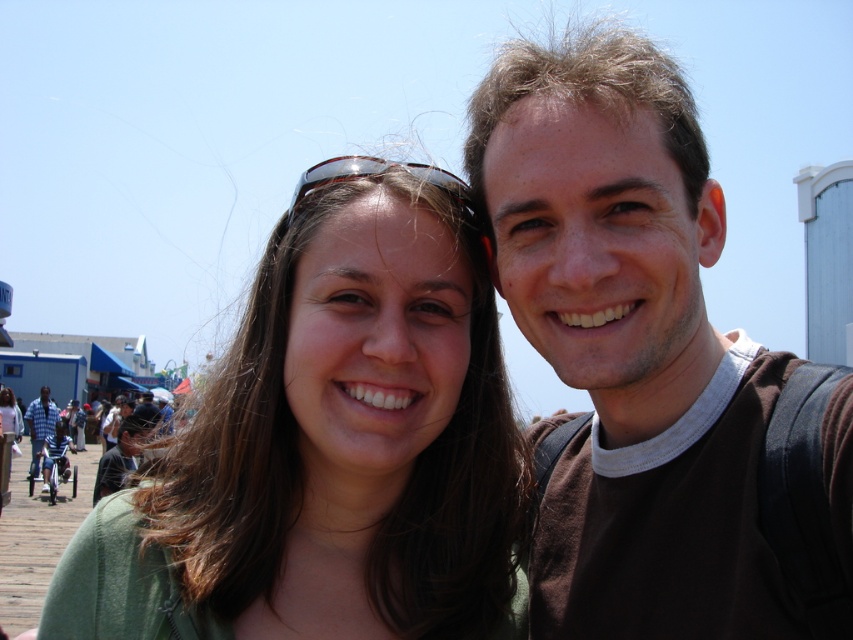
Based on the photo, who is taller, green matte hair at center or blue striped shirt at left?

With more height is green matte hair at center.

Which is below, green matte hair at center or blue striped shirt at left?

blue striped shirt at left

In order to click on green matte hair at center in this screenshot , I will do `click(329, 445)`.

Between sunglasses at center and blue striped shirt at left, which one is positioned lower?

blue striped shirt at left

Is point (434, 172) positioned before point (32, 422)?

Yes, point (434, 172) is in front of point (32, 422).

Between point (428, 166) and point (28, 410), which one is positioned behind?

The point (28, 410) is more distant.

Where is `sunglasses at center`? sunglasses at center is located at coordinates (375, 176).

Which is more to the right, green matte hair at center or brown cotton t-shirt at upper right?

From the viewer's perspective, brown cotton t-shirt at upper right appears more on the right side.

Can you confirm if green matte hair at center is positioned above brown cotton t-shirt at upper right?

Incorrect, green matte hair at center is not positioned above brown cotton t-shirt at upper right.

Between point (360, 387) and point (605, 49), which one is positioned behind?

Positioned behind is point (360, 387).

This screenshot has width=853, height=640. Identify the location of green matte hair at center. (329, 445).